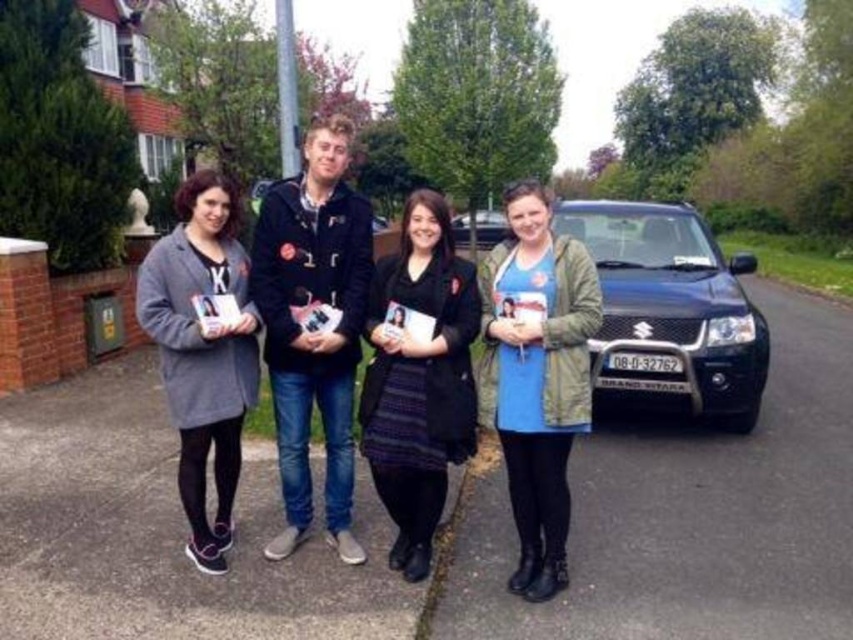
You are a photographer trying to capture a group photo of the matte black jacket at center and the black matte suv at right. If you want to ensure both subjects are fully visible in the frame, which subject should you position closer to the camera to avoid cropping?

The matte black jacket at center has a lesser width compared to the black matte suv at right. To ensure both are fully visible, position the matte black jacket at center closer to the camera since it is narrower and requires less space in the frame.

You are standing at the point marked by the coordinates point (202, 349). Looking around, you see a gray wool coat at left. What direction should you face to see the gray wool coat at left?

You should face to your left to see the gray wool coat at left.